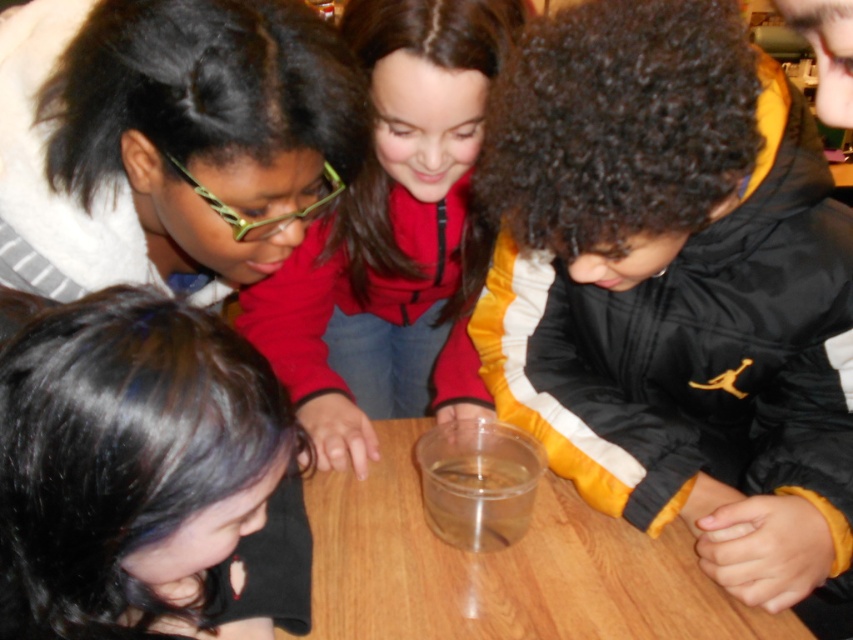
What do you see at coordinates (144, 476) in the screenshot? Image resolution: width=853 pixels, height=640 pixels. I see `black matte hair at lower left` at bounding box center [144, 476].

This screenshot has width=853, height=640. I want to click on black matte hair at lower left, so click(x=144, y=476).

Can you confirm if matte black hair at upper left is thinner than transparent plastic table at center?

Indeed, matte black hair at upper left has a lesser width compared to transparent plastic table at center.

Does matte black hair at upper left lie in front of transparent plastic table at center?

Yes.

Is point (126, 124) closer to camera compared to point (730, 604)?

Yes, it is.

At what (x,y) coordinates should I click in order to perform the action: click on matte black hair at upper left. Please return your answer as a coordinate pair (x, y). Looking at the image, I should click on (167, 140).

Between black matte jacket at center and transparent plastic table at center, which one is positioned lower?

transparent plastic table at center is below.

Is black matte jacket at center in front of transparent plastic table at center?

Yes, it is.

Identify the location of black matte jacket at center. (674, 288).